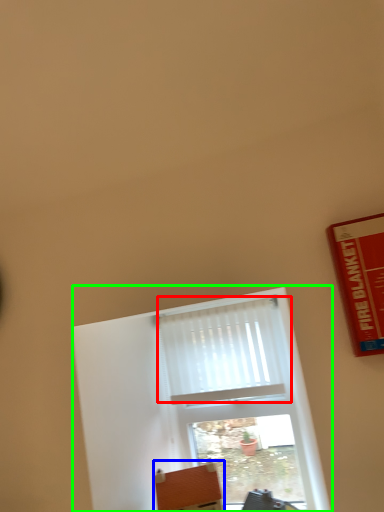
Question: Which object is the closest to the curtain (highlighted by a red box)? Choose among these: furniture (highlighted by a blue box) or window (highlighted by a green box).

Choices:
 (A) furniture
 (B) window

Answer: (B)